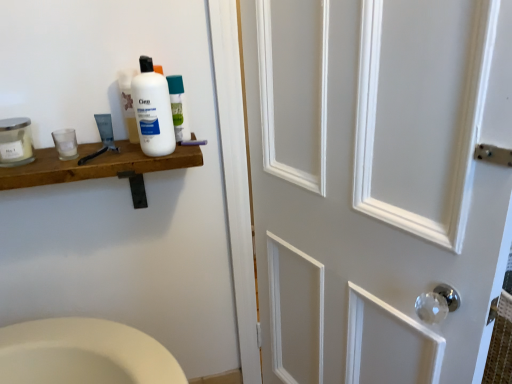
Find the location of a particular element. The width and height of the screenshot is (512, 384). white painted wood door at right is located at coordinates (377, 183).

Measure the distance between clear glass mouthwash at left, the second mouthwash viewed from the right, and camera.

A distance of 3.41 feet exists between clear glass mouthwash at left, the second mouthwash viewed from the right, and camera.

This screenshot has width=512, height=384. Find the location of `white plastic bottle at upper left`. white plastic bottle at upper left is located at coordinates (153, 111).

Is white glossy mouthwash at upper center, which appears as the third mouthwash when viewed from the left, facing away from white plastic bottle at upper left?

No, white glossy mouthwash at upper center, which appears as the third mouthwash when viewed from the left,'s orientation is not away from white plastic bottle at upper left.

Between white glossy mouthwash at upper center, which appears as the third mouthwash when viewed from the left, and white plastic bottle at upper left, which one has larger size?

white plastic bottle at upper left.

Is white glossy mouthwash at upper center, which appears as the third mouthwash when viewed from the left, to the right of white plastic bottle at upper left from the viewer's perspective?

Indeed, white glossy mouthwash at upper center, which appears as the third mouthwash when viewed from the left, is positioned on the right side of white plastic bottle at upper left.

Relative to white plastic bottle at upper left, is white glossy mouthwash at upper center, which is the first mouthwash in right-to-left order, in front or behind?

white glossy mouthwash at upper center, which is the first mouthwash in right-to-left order, is behind white plastic bottle at upper left.

Is clear glass jar at left, which is the first mouthwash from left to right, inside the boundaries of white glossy mouthwash at upper center, which appears as the third mouthwash when viewed from the left, or outside?

clear glass jar at left, which is the first mouthwash from left to right, cannot be found inside white glossy mouthwash at upper center, which appears as the third mouthwash when viewed from the left.

From the white glossy mouthwash at upper center, which appears as the third mouthwash when viewed from the left, count 2nd mouthwashs forward and point to it. Please provide its 2D coordinates.

[(15, 142)]

From a real-world perspective, which is physically above, clear glass jar at left, which is the first mouthwash from left to right, or white glossy mouthwash at upper center, which appears as the third mouthwash when viewed from the left?

white glossy mouthwash at upper center, which appears as the third mouthwash when viewed from the left, from a real-world perspective.

Considering the relative sizes of clear glass jar at left, which is the first mouthwash from left to right, and white glossy mouthwash at upper center, which appears as the third mouthwash when viewed from the left, in the image provided, is clear glass jar at left, which is the first mouthwash from left to right, shorter than white glossy mouthwash at upper center, which appears as the third mouthwash when viewed from the left,?

Yes.

Is the position of white plastic bottle at upper left more distant than that of white painted wood door at right?

Yes, white plastic bottle at upper left is further from the viewer.

Considering the relative sizes of white plastic bottle at upper left and white painted wood door at right in the image provided, is white plastic bottle at upper left wider than white painted wood door at right?

In fact, white plastic bottle at upper left might be narrower than white painted wood door at right.

Is white plastic bottle at upper left positioned with its back to white painted wood door at right?

No.

Which of these two, white plastic bottle at upper left or white painted wood door at right, stands taller?

white painted wood door at right is taller.

You are a GUI agent. You are given a task and a screenshot of the screen. Output one action in this format:
    pyautogui.click(x=<x>, y=<y>)
    Task: Click on the 2nd mouthwash counting from the left side of the white painted wood door at right
    The width and height of the screenshot is (512, 384).
    Given the screenshot: What is the action you would take?
    pyautogui.click(x=65, y=143)

From the image's perspective, is clear glass mouthwash at left, the second mouthwash viewed from the right, above or below white painted wood door at right?

Based on their image positions, clear glass mouthwash at left, the second mouthwash viewed from the right, is located above white painted wood door at right.

Is white painted wood door at right completely or partially inside clear glass mouthwash at left, which is the second mouthwash in left-to-right order?

No, clear glass mouthwash at left, which is the second mouthwash in left-to-right order, does not contain white painted wood door at right.

Considering the sizes of white plastic bottle at upper left and white glossy mouthwash at upper center, which appears as the third mouthwash when viewed from the left, in the image, is white plastic bottle at upper left bigger or smaller than white glossy mouthwash at upper center, which appears as the third mouthwash when viewed from the left,?

Clearly, white plastic bottle at upper left is larger in size than white glossy mouthwash at upper center, which appears as the third mouthwash when viewed from the left.

Considering the relative positions of white plastic bottle at upper left and white glossy mouthwash at upper center, which appears as the third mouthwash when viewed from the left, in the image provided, is white plastic bottle at upper left to the left of white glossy mouthwash at upper center, which appears as the third mouthwash when viewed from the left, from the viewer's perspective?

Indeed, white plastic bottle at upper left is positioned on the left side of white glossy mouthwash at upper center, which appears as the third mouthwash when viewed from the left.

Is white glossy mouthwash at upper center, which is the first mouthwash in right-to-left order, located within white plastic bottle at upper left?

No, white glossy mouthwash at upper center, which is the first mouthwash in right-to-left order, is not surrounded by white plastic bottle at upper left.

From a real-world perspective, does white plastic bottle at upper left sit lower than white glossy mouthwash at upper center, which appears as the third mouthwash when viewed from the left?

No, from a real-world perspective, white plastic bottle at upper left is not beneath white glossy mouthwash at upper center, which appears as the third mouthwash when viewed from the left.

Between white glossy mouthwash at upper center, which is the first mouthwash in right-to-left order, and clear glass mouthwash at left, which is the second mouthwash in left-to-right order, which one has larger size?

Bigger between the two is white glossy mouthwash at upper center, which is the first mouthwash in right-to-left order.

Considering the positions of objects white glossy mouthwash at upper center, which is the first mouthwash in right-to-left order, and clear glass mouthwash at left, which is the second mouthwash in left-to-right order, in the image provided, who is more to the left, white glossy mouthwash at upper center, which is the first mouthwash in right-to-left order, or clear glass mouthwash at left, which is the second mouthwash in left-to-right order,?

clear glass mouthwash at left, which is the second mouthwash in left-to-right order, is more to the left.

In terms of width, does white glossy mouthwash at upper center, which appears as the third mouthwash when viewed from the left, look wider or thinner when compared to clear glass mouthwash at left, the second mouthwash viewed from the right?

In the image, white glossy mouthwash at upper center, which appears as the third mouthwash when viewed from the left, appears to be wider than clear glass mouthwash at left, the second mouthwash viewed from the right.

Can you see white glossy mouthwash at upper center, which is the first mouthwash in right-to-left order, touching clear glass mouthwash at left, which is the second mouthwash in left-to-right order?

They are not placed beside each other.

From the image's perspective, between clear glass mouthwash at left, the second mouthwash viewed from the right, and clear glass jar at left, which is the first mouthwash from left to right, which one is located above?

clear glass jar at left, which is the first mouthwash from left to right, appears higher in the image.

Is clear glass mouthwash at left, which is the second mouthwash in left-to-right order, aimed at clear glass jar at left, the third mouthwash when ordered from right to left?

No, clear glass mouthwash at left, which is the second mouthwash in left-to-right order, is not facing towards clear glass jar at left, the third mouthwash when ordered from right to left.

Is clear glass mouthwash at left, the second mouthwash viewed from the right, to the left of clear glass jar at left, which is the first mouthwash from left to right, from the viewer's perspective?

No, clear glass mouthwash at left, the second mouthwash viewed from the right, is not to the left of clear glass jar at left, which is the first mouthwash from left to right.

Does clear glass mouthwash at left, the second mouthwash viewed from the right, come in front of clear glass jar at left, which is the first mouthwash from left to right?

No, it is behind clear glass jar at left, which is the first mouthwash from left to right.

Locate an element on the screen. This screenshot has width=512, height=384. mouthwash on the right of white plastic bottle at upper left is located at coordinates (178, 108).

The height and width of the screenshot is (384, 512). What are the coordinates of `the 2nd mouthwash to the left when counting from the white glossy mouthwash at upper center, which is the first mouthwash in right-to-left order` in the screenshot? It's located at (15, 142).

From the image, which object appears to be nearer to white painted wood door at right, clear glass jar at left, which is the first mouthwash from left to right, or white plastic bottle at upper left?

white plastic bottle at upper left is positioned closer to the anchor white painted wood door at right.

When comparing their distances from white painted wood door at right, does white glossy mouthwash at upper center, which is the first mouthwash in right-to-left order, or clear glass mouthwash at left, the second mouthwash viewed from the right, seem closer?

white glossy mouthwash at upper center, which is the first mouthwash in right-to-left order, is positioned closer to the anchor white painted wood door at right.

Looking at the image, which one is located further to white plastic bottle at upper left, clear glass jar at left, the third mouthwash when ordered from right to left, or clear glass mouthwash at left, the second mouthwash viewed from the right?

clear glass jar at left, the third mouthwash when ordered from right to left, is further to white plastic bottle at upper left.

From the image, which object appears to be nearer to clear glass mouthwash at left, the second mouthwash viewed from the right, white plastic bottle at upper left or white painted wood door at right?

Based on the image, white plastic bottle at upper left appears to be nearer to clear glass mouthwash at left, the second mouthwash viewed from the right.

Estimate the real-world distances between objects in this image. Which object is further from clear glass mouthwash at left, the second mouthwash viewed from the right, white glossy mouthwash at upper center, which is the first mouthwash in right-to-left order, or white painted wood door at right?

white painted wood door at right is positioned further to the anchor clear glass mouthwash at left, the second mouthwash viewed from the right.

Based on their spatial positions, is white glossy mouthwash at upper center, which is the first mouthwash in right-to-left order, or white painted wood door at right further from clear glass jar at left, which is the first mouthwash from left to right?

white painted wood door at right.

From the image, which object appears to be nearer to white painted wood door at right, white plastic bottle at upper left or clear glass jar at left, the third mouthwash when ordered from right to left?

The object closer to white painted wood door at right is white plastic bottle at upper left.

When comparing their distances from clear glass jar at left, the third mouthwash when ordered from right to left, does clear glass mouthwash at left, the second mouthwash viewed from the right, or white painted wood door at right seem closer?

The object closer to clear glass jar at left, the third mouthwash when ordered from right to left, is clear glass mouthwash at left, the second mouthwash viewed from the right.

Find the location of a particular element. The image size is (512, 384). mouthwash between clear glass mouthwash at left, the second mouthwash viewed from the right, and white painted wood door at right is located at coordinates (178, 108).

Where is `cleaning product between clear glass jar at left, which is the first mouthwash from left to right, and white glossy mouthwash at upper center, which is the first mouthwash in right-to-left order, from left to right`? cleaning product between clear glass jar at left, which is the first mouthwash from left to right, and white glossy mouthwash at upper center, which is the first mouthwash in right-to-left order, from left to right is located at coordinates (153, 111).

At what (x,y) coordinates should I click in order to perform the action: click on mouthwash situated between clear glass jar at left, which is the first mouthwash from left to right, and white plastic bottle at upper left from left to right. Please return your answer as a coordinate pair (x, y). The height and width of the screenshot is (384, 512). Looking at the image, I should click on coord(65,143).

Find the location of a particular element. cleaning product located between clear glass mouthwash at left, which is the second mouthwash in left-to-right order, and white painted wood door at right in the left-right direction is located at coordinates (153, 111).